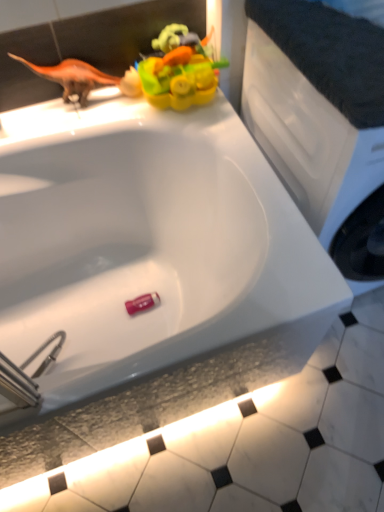
The height and width of the screenshot is (512, 384). What are the coordinates of `empty space that is ontop of white glossy tile at lower center` in the screenshot? It's located at (251, 444).